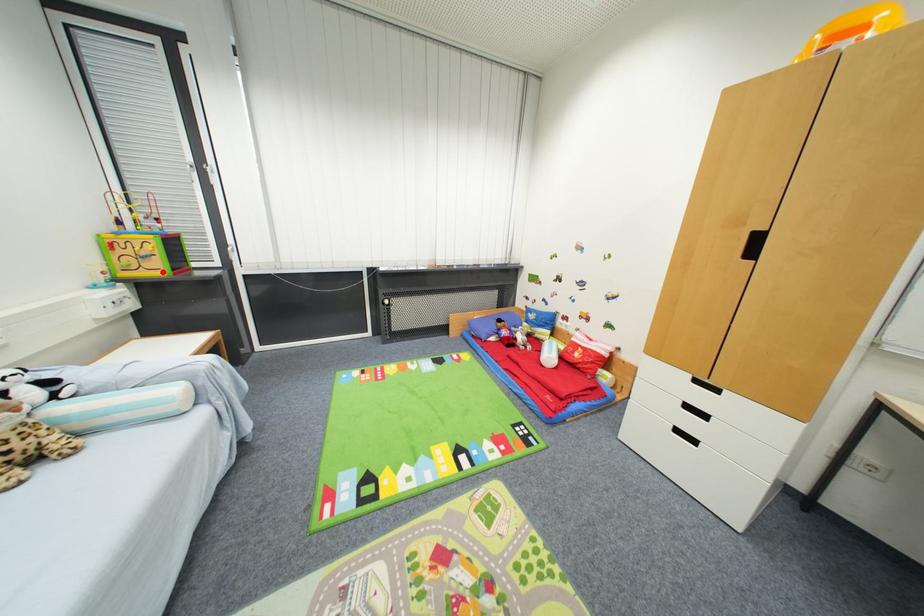
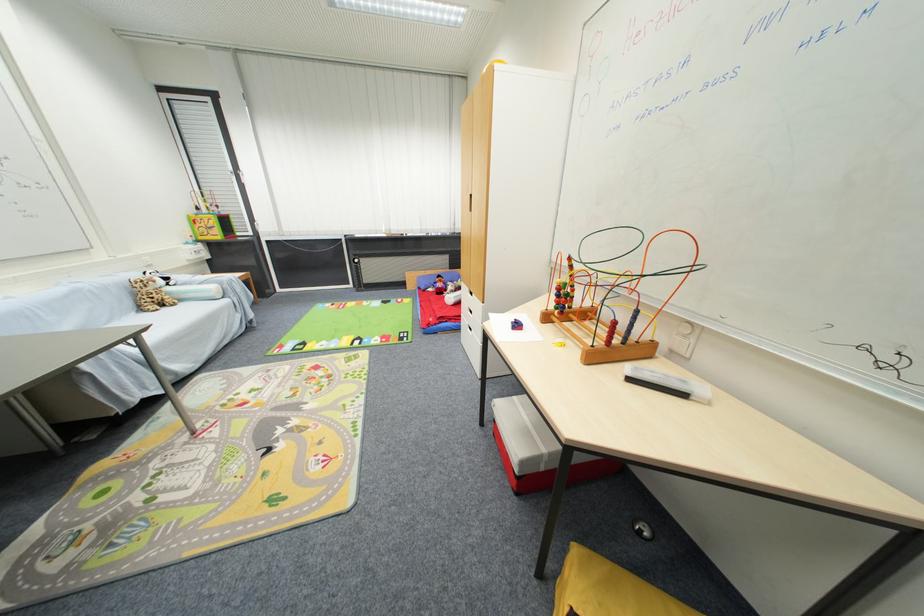
Find the pixel in the second image that matches the highlighted location in the first image.

(223, 238)